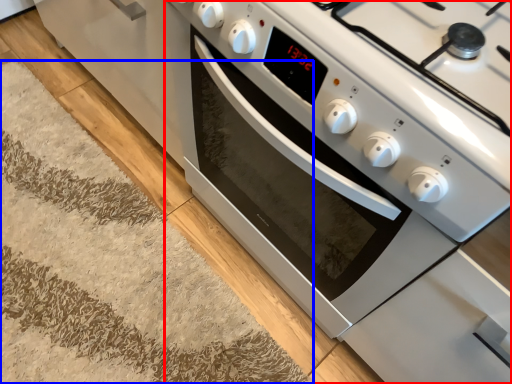
Question: Among these objects, which one is nearest to the camera, oven (highlighted by a red box) or doormat (highlighted by a blue box)?

Choices:
 (A) oven
 (B) doormat

Answer: (A)